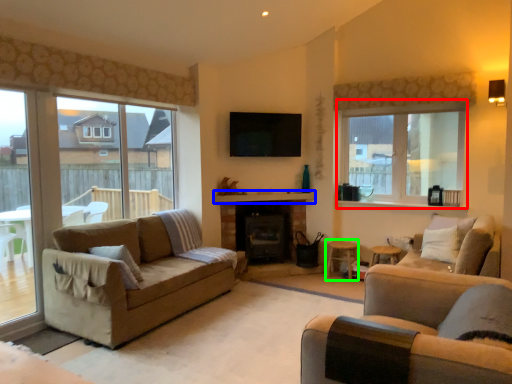
Question: Considering the real-world distances, which object is closest to window (highlighted by a red box)? mantle (highlighted by a blue box) or stool (highlighted by a green box).

Choices:
 (A) mantle
 (B) stool

Answer: (A)